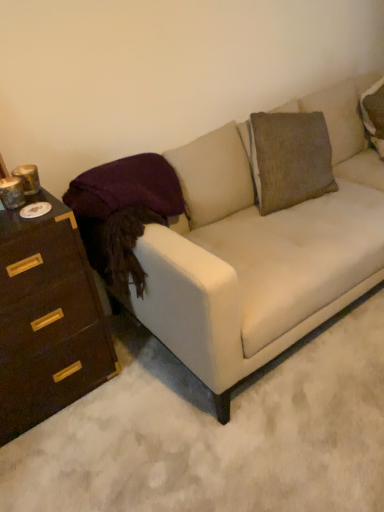
In order to click on free space that is in between dark brown wood chest of drawers at left and white fabric couch at center in this screenshot , I will do (123, 410).